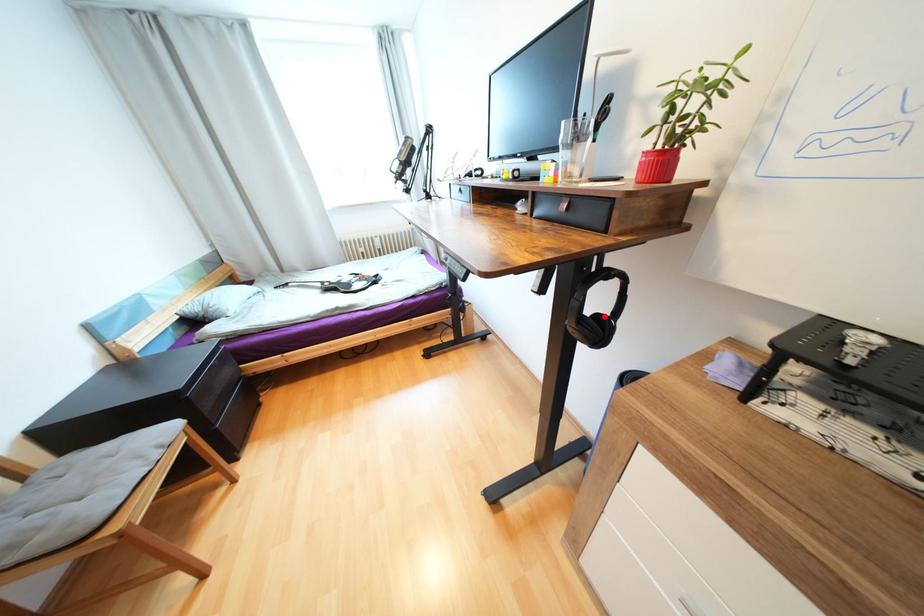
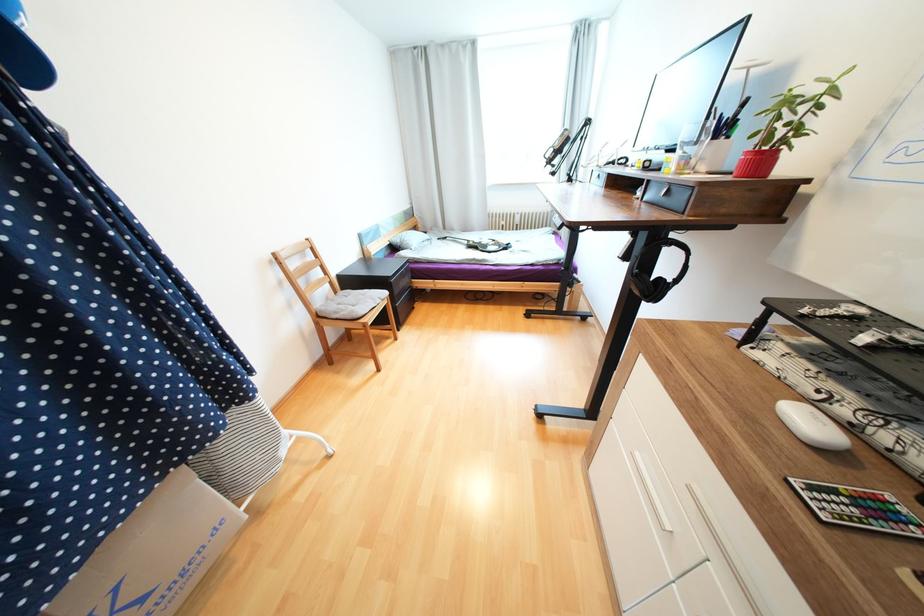
The point at the highlighted location is marked in the first image. Where is the corresponding point in the second image?

(665, 280)